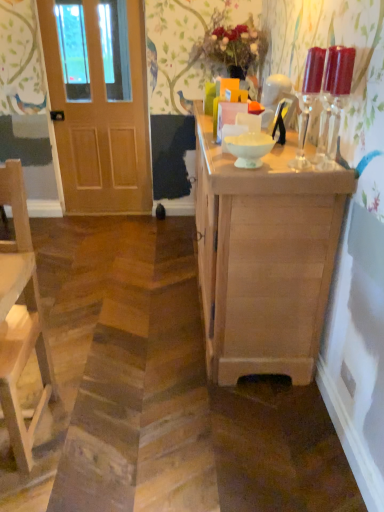
Locate an element on the screen. This screenshot has height=512, width=384. free space in front of white glossy bowl at center is located at coordinates tap(248, 176).